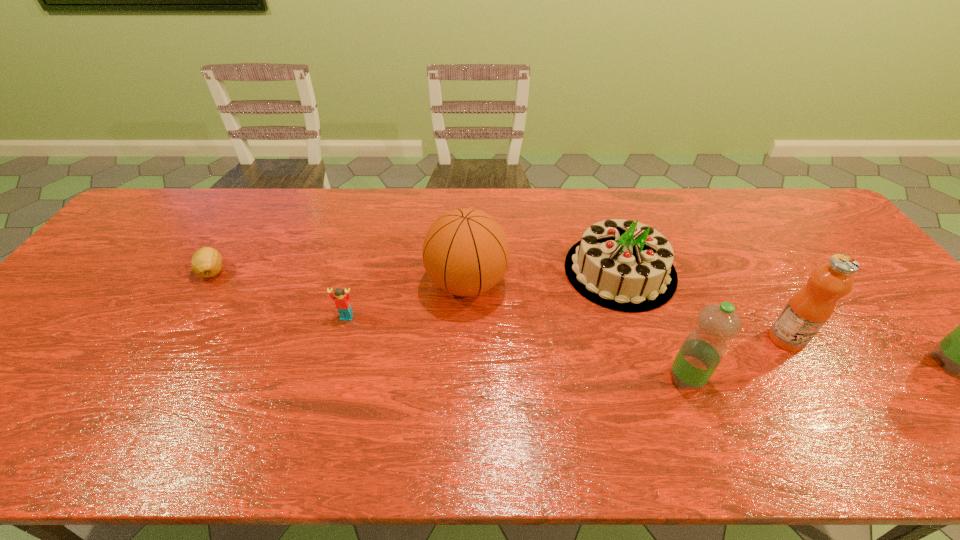
Image resolution: width=960 pixels, height=540 pixels. Identify the location of vacant space that satisfies the following two spatial constraints: 1. at the stem end of the fruit juice; 2. on the right side of the shortest object. (172, 339).

The width and height of the screenshot is (960, 540). Identify the location of free space that satisfies the following two spatial constraints: 1. on the face of the second shortest object; 2. on the left side of the second object from right to left. (341, 339).